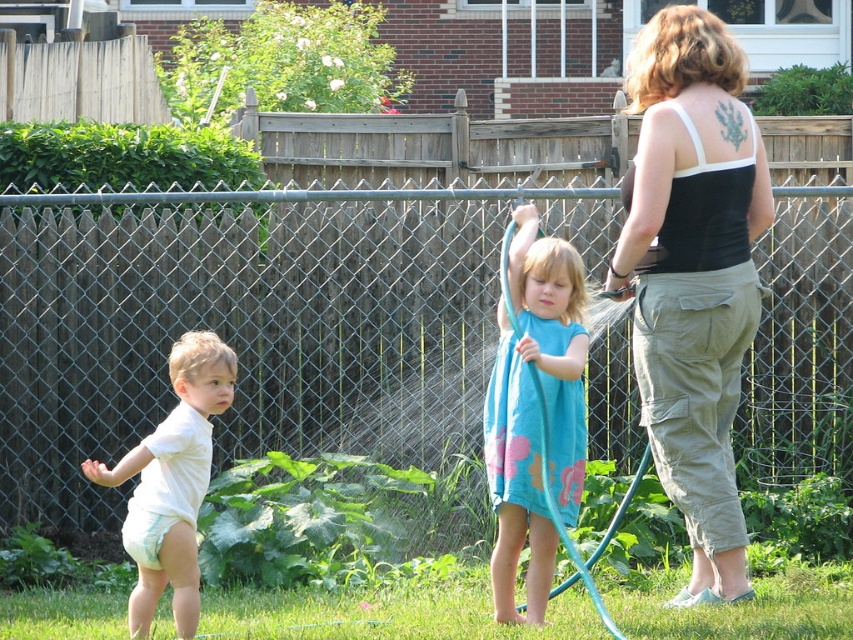
Question: Does black tank top at upper right appear on the left side of blue rubber hose at center?

Choices:
 (A) yes
 (B) no

Answer: (B)

Question: Can you confirm if white cotton shirt at left is wider than blue rubber hose at center?

Choices:
 (A) yes
 (B) no

Answer: (B)

Question: Which of the following is the closest to the observer?

Choices:
 (A) (552, 496)
 (B) (700, 166)
 (C) (189, 444)

Answer: (C)

Question: Which point is farther from the camera taking this photo?

Choices:
 (A) (189, 608)
 (B) (548, 428)

Answer: (B)

Question: Observing the image, what is the correct spatial positioning of black tank top at upper right in reference to white cotton shirt at left?

Choices:
 (A) below
 (B) above

Answer: (B)

Question: Which point is farther to the camera?

Choices:
 (A) white cotton shirt at left
 (B) black tank top at upper right

Answer: (B)